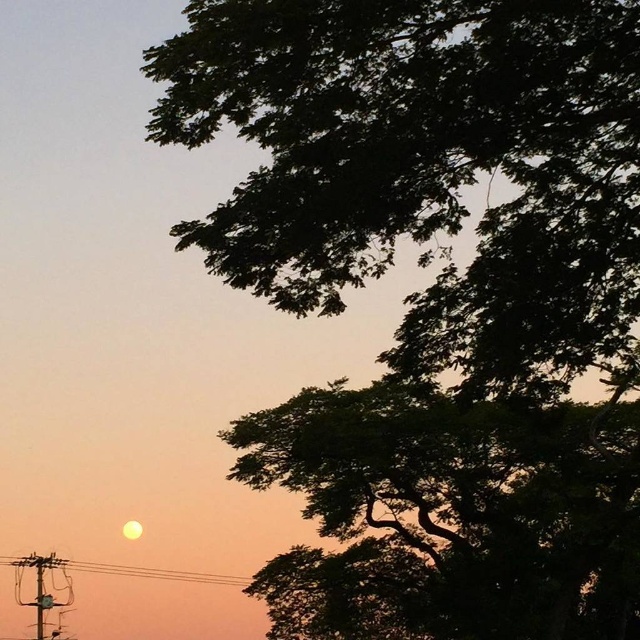
Is dark green leafy tree at upper right smaller than metallic wire at lower left?

Incorrect, dark green leafy tree at upper right is not smaller in size than metallic wire at lower left.

Is dark green leafy tree at upper right taller than metallic wire at lower left?

Yes, dark green leafy tree at upper right is taller than metallic wire at lower left.

Image resolution: width=640 pixels, height=640 pixels. What do you see at coordinates (449, 515) in the screenshot? I see `dark green leafy tree at upper right` at bounding box center [449, 515].

The image size is (640, 640). Identify the location of dark green leafy tree at upper right. (449, 515).